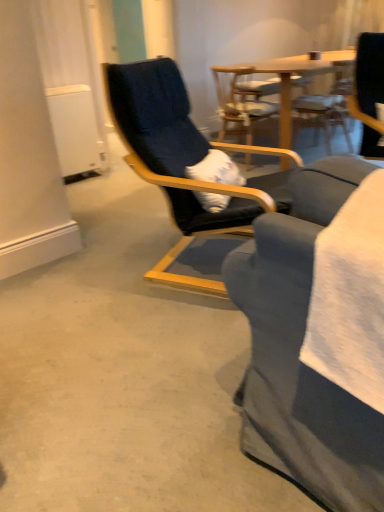
You are a GUI agent. You are given a task and a screenshot of the screen. Output one action in this format:
    pyautogui.click(x=<x>, y=<y>)
    Task: Click on the wooden chair at center, arranged as the third chair when viewed from the front
    This screenshot has height=512, width=384.
    Given the screenshot: What is the action you would take?
    pyautogui.click(x=339, y=59)

This screenshot has width=384, height=512. Describe the element at coordinates (180, 161) in the screenshot. I see `black fabric chair at center, positioned as the first chair in front-to-back order` at that location.

You are a GUI agent. You are given a task and a screenshot of the screen. Output one action in this format:
    pyautogui.click(x=<x>, y=<y>)
    Task: Click on the wooden chair at center, the 1th chair in the back-to-front sequence
    This screenshot has height=512, width=384.
    Given the screenshot: What is the action you would take?
    pyautogui.click(x=339, y=59)

Is wooden chair at center, placed as the second chair when sorted from front to back, inside the boundaries of wooden chair at center, arranged as the third chair when viewed from the front, or outside?

wooden chair at center, placed as the second chair when sorted from front to back, is spatially situated outside wooden chair at center, arranged as the third chair when viewed from the front.

From the image's perspective, is wooden chair at center, positioned as the 2th chair in back-to-front order, located above wooden chair at center, arranged as the third chair when viewed from the front?

No.

How distant is wooden chair at center, positioned as the 2th chair in back-to-front order, from wooden chair at center, arranged as the third chair when viewed from the front?

The distance of wooden chair at center, positioned as the 2th chair in back-to-front order, from wooden chair at center, arranged as the third chair when viewed from the front, is 20.08 inches.

Is wooden chair at center, positioned as the 2th chair in back-to-front order, thinner than wooden chair at center, arranged as the third chair when viewed from the front?

No.

Does black fabric chair at center, positioned as the first chair in front-to-back order, lie in front of wooden chair at center, the 1th chair in the back-to-front sequence?

Yes, it is in front of wooden chair at center, the 1th chair in the back-to-front sequence.

Looking at their sizes, would you say black fabric chair at center, acting as the 3th chair starting from the back, is wider or thinner than wooden chair at center, arranged as the third chair when viewed from the front?

Considering their sizes, black fabric chair at center, acting as the 3th chair starting from the back, looks broader than wooden chair at center, arranged as the third chair when viewed from the front.

From the picture: From a real-world perspective, is black fabric chair at center, acting as the 3th chair starting from the back, beneath wooden chair at center, the 1th chair in the back-to-front sequence?

Incorrect, from a real-world perspective, black fabric chair at center, acting as the 3th chair starting from the back, is higher than wooden chair at center, the 1th chair in the back-to-front sequence.

Is black fabric chair at center, positioned as the first chair in front-to-back order, touching wooden chair at center, the 1th chair in the back-to-front sequence?

They are not placed beside each other.

Is wooden chair at center, positioned as the 2th chair in back-to-front order, turned away from black fabric chair at center, positioned as the first chair in front-to-back order?

No, wooden chair at center, positioned as the 2th chair in back-to-front order, is not facing away from black fabric chair at center, positioned as the first chair in front-to-back order.

Is wooden chair at center, positioned as the 2th chair in back-to-front order, not close to black fabric chair at center, positioned as the first chair in front-to-back order?

wooden chair at center, positioned as the 2th chair in back-to-front order, is far away from black fabric chair at center, positioned as the first chair in front-to-back order.

Does wooden chair at center, placed as the second chair when sorted from front to back, appear on the right side of black fabric chair at center, acting as the 3th chair starting from the back?

Correct, you'll find wooden chair at center, placed as the second chair when sorted from front to back, to the right of black fabric chair at center, acting as the 3th chair starting from the back.

In terms of width, does wooden chair at center, positioned as the 2th chair in back-to-front order, look wider or thinner when compared to black fabric chair at center, acting as the 3th chair starting from the back?

Considering their sizes, wooden chair at center, positioned as the 2th chair in back-to-front order, looks slimmer than black fabric chair at center, acting as the 3th chair starting from the back.

Between wooden chair at center, the 1th chair in the back-to-front sequence, and wooden chair at center, placed as the second chair when sorted from front to back, which one has smaller width?

wooden chair at center, the 1th chair in the back-to-front sequence.

Is wooden chair at center, the 1th chair in the back-to-front sequence, outside of wooden chair at center, positioned as the 2th chair in back-to-front order?

That's correct, wooden chair at center, the 1th chair in the back-to-front sequence, is outside of wooden chair at center, positioned as the 2th chair in back-to-front order.

How many degrees apart are the facing directions of wooden chair at center, arranged as the third chair when viewed from the front, and wooden chair at center, positioned as the 2th chair in back-to-front order?

They differ by 90 degrees in their facing directions.

From the image's perspective, is wooden chair at center, the 1th chair in the back-to-front sequence, positioned above or below black fabric chair at center, positioned as the first chair in front-to-back order?

wooden chair at center, the 1th chair in the back-to-front sequence, is situated higher than black fabric chair at center, positioned as the first chair in front-to-back order, in the image.

From the image's perspective, count 2nd chairs upward from the black fabric chair at center, positioned as the first chair in front-to-back order, and point to it. Please provide its 2D coordinates.

[(339, 59)]

From a real-world perspective, who is located lower, wooden chair at center, arranged as the third chair when viewed from the front, or black fabric chair at center, acting as the 3th chair starting from the back?

From a 3D spatial view, wooden chair at center, arranged as the third chair when viewed from the front, is below.

Considering the relative sizes of wooden chair at center, the 1th chair in the back-to-front sequence, and black fabric chair at center, acting as the 3th chair starting from the back, in the image provided, is wooden chair at center, the 1th chair in the back-to-front sequence, bigger than black fabric chair at center, acting as the 3th chair starting from the back,?

Actually, wooden chair at center, the 1th chair in the back-to-front sequence, might be smaller than black fabric chair at center, acting as the 3th chair starting from the back.

Could you tell me if black fabric chair at center, acting as the 3th chair starting from the back, is turned towards wooden chair at center, placed as the second chair when sorted from front to back?

No.

Can you tell me how much black fabric chair at center, positioned as the first chair in front-to-back order, and wooden chair at center, placed as the second chair when sorted from front to back, differ in facing direction?

There is a 68.9-degree angle between the facing directions of black fabric chair at center, positioned as the first chair in front-to-back order, and wooden chair at center, placed as the second chair when sorted from front to back.

Does point (185, 99) appear closer or farther from the camera than point (235, 74)?

Point (185, 99) is closer to the camera than point (235, 74).

Starting from the wooden chair at center, the 1th chair in the back-to-front sequence, which chair is the 1st one to the left? Please provide its 2D coordinates.

[(242, 100)]

Where is `the 2nd chair below the black fabric chair at center, positioned as the first chair in front-to-back order (from a real-world perspective)`? Image resolution: width=384 pixels, height=512 pixels. the 2nd chair below the black fabric chair at center, positioned as the first chair in front-to-back order (from a real-world perspective) is located at coordinates (x=339, y=59).

Estimate the real-world distances between objects in this image. Which object is closer to wooden chair at center, arranged as the third chair when viewed from the front, wooden chair at center, positioned as the 2th chair in back-to-front order, or black fabric chair at center, acting as the 3th chair starting from the back?

Among the two, wooden chair at center, positioned as the 2th chair in back-to-front order, is located nearer to wooden chair at center, arranged as the third chair when viewed from the front.

Considering their positions, is black fabric chair at center, positioned as the first chair in front-to-back order, positioned closer to wooden chair at center, placed as the second chair when sorted from front to back, than wooden chair at center, arranged as the third chair when viewed from the front?

Among the two, wooden chair at center, arranged as the third chair when viewed from the front, is located nearer to wooden chair at center, placed as the second chair when sorted from front to back.

Looking at this image, estimate the real-world distances between objects in this image. Which object is further from wooden chair at center, placed as the second chair when sorted from front to back, wooden chair at center, arranged as the third chair when viewed from the front, or black fabric chair at center, positioned as the first chair in front-to-back order?

Among the two, black fabric chair at center, positioned as the first chair in front-to-back order, is located further to wooden chair at center, placed as the second chair when sorted from front to back.

In the scene shown: From the image, which object appears to be nearer to black fabric chair at center, acting as the 3th chair starting from the back, wooden chair at center, placed as the second chair when sorted from front to back, or wooden chair at center, arranged as the third chair when viewed from the front?

Among the two, wooden chair at center, placed as the second chair when sorted from front to back, is located nearer to black fabric chair at center, acting as the 3th chair starting from the back.

From the image, which object appears to be nearer to wooden chair at center, arranged as the third chair when viewed from the front, black fabric chair at center, positioned as the first chair in front-to-back order, or wooden chair at center, positioned as the 2th chair in back-to-front order?

Based on the image, wooden chair at center, positioned as the 2th chair in back-to-front order, appears to be nearer to wooden chair at center, arranged as the third chair when viewed from the front.

Looking at the image, which one is located further to black fabric chair at center, acting as the 3th chair starting from the back, wooden chair at center, the 1th chair in the back-to-front sequence, or wooden chair at center, placed as the second chair when sorted from front to back?

wooden chair at center, the 1th chair in the back-to-front sequence, is positioned further to the anchor black fabric chair at center, acting as the 3th chair starting from the back.

Where is `chair positioned between black fabric chair at center, positioned as the first chair in front-to-back order, and wooden chair at center, the 1th chair in the back-to-front sequence, from near to far`? This screenshot has width=384, height=512. chair positioned between black fabric chair at center, positioned as the first chair in front-to-back order, and wooden chair at center, the 1th chair in the back-to-front sequence, from near to far is located at coordinates (242, 100).